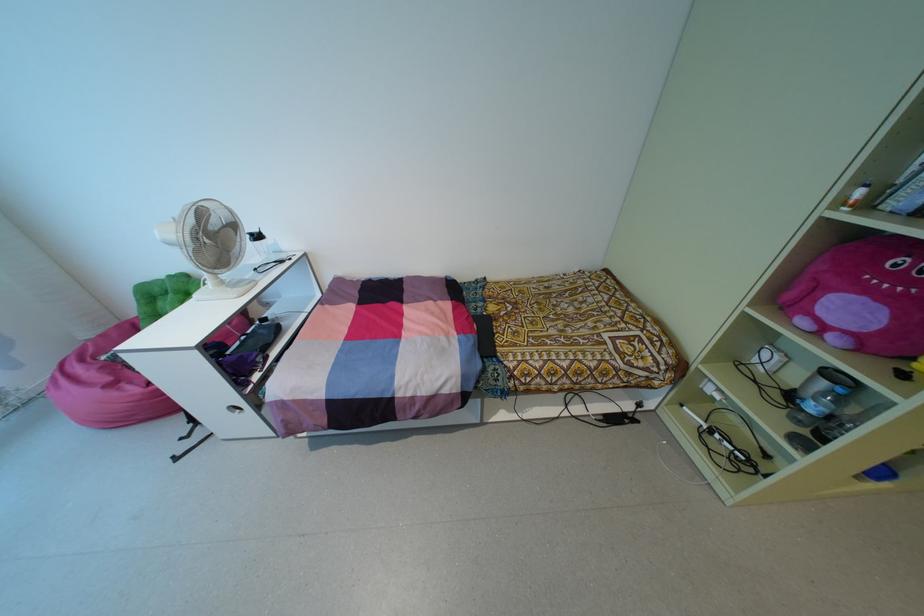
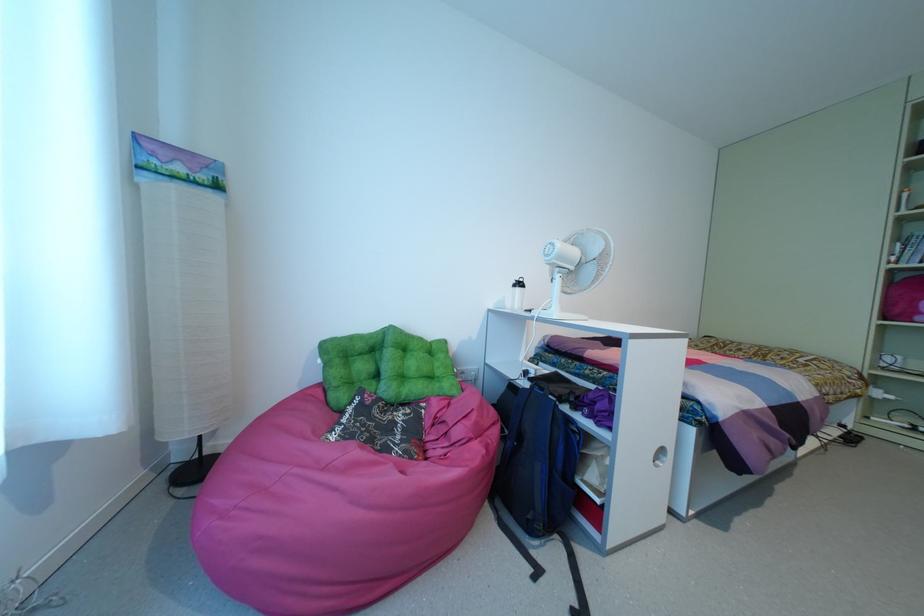
The point at (x=103, y=357) is marked in the first image. Where is the corresponding point in the second image?

(332, 437)